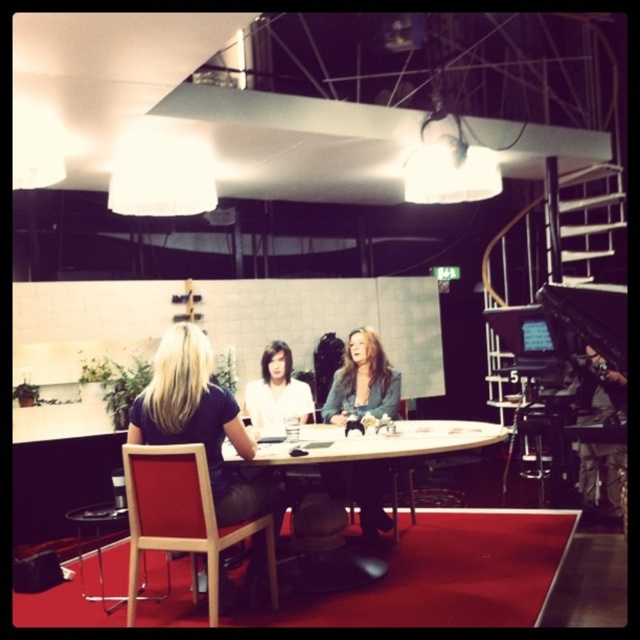
Question: Which object is closer to the camera taking this photo?

Choices:
 (A) wooden round table at center
 (B) matte white shirt at center
 (C) wooden chair at lower left

Answer: (C)

Question: Can you confirm if wooden round table at center is positioned to the right of matte white shirt at center?

Choices:
 (A) no
 (B) yes

Answer: (B)

Question: Does matte gray blazer at center appear on the left side of matte white shirt at center?

Choices:
 (A) yes
 (B) no

Answer: (B)

Question: Which object is farther from the camera taking this photo?

Choices:
 (A) matte gray blazer at center
 (B) wooden round table at center
 (C) wooden chair at lower left
 (D) matte white shirt at center

Answer: (A)

Question: Among these objects, which one is nearest to the camera?

Choices:
 (A) matte gray blazer at center
 (B) wooden round table at center
 (C) wooden chair at lower left

Answer: (C)

Question: Is wooden chair at lower left to the right of matte white shirt at center from the viewer's perspective?

Choices:
 (A) no
 (B) yes

Answer: (A)